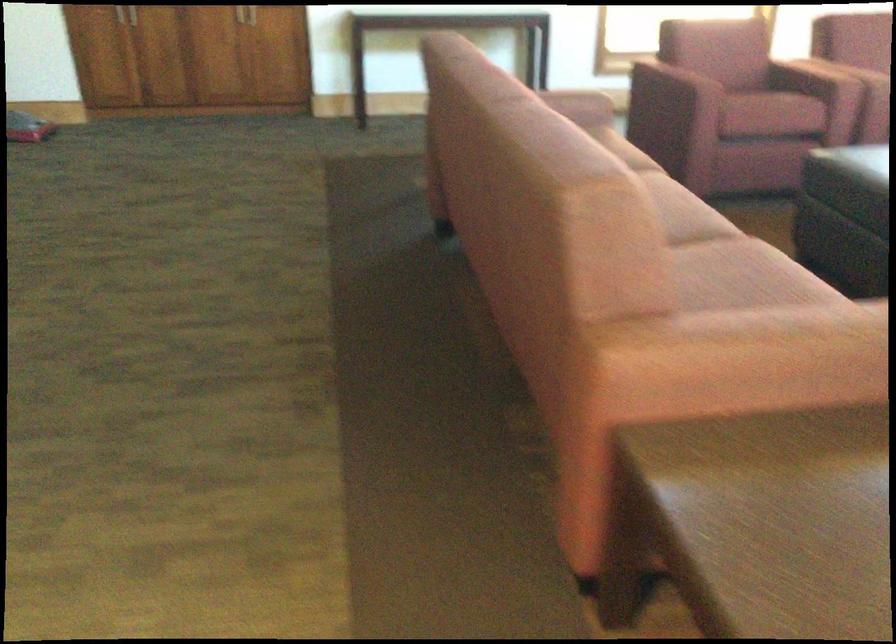
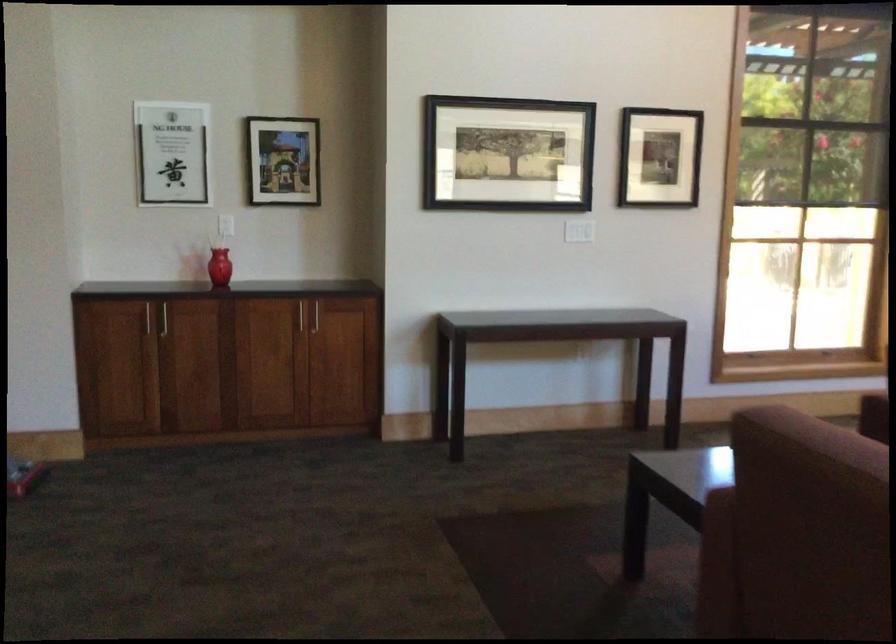
From the picture: What movement of the cameraman would produce the second image?

The movement direction of the cameraman is left, forward.